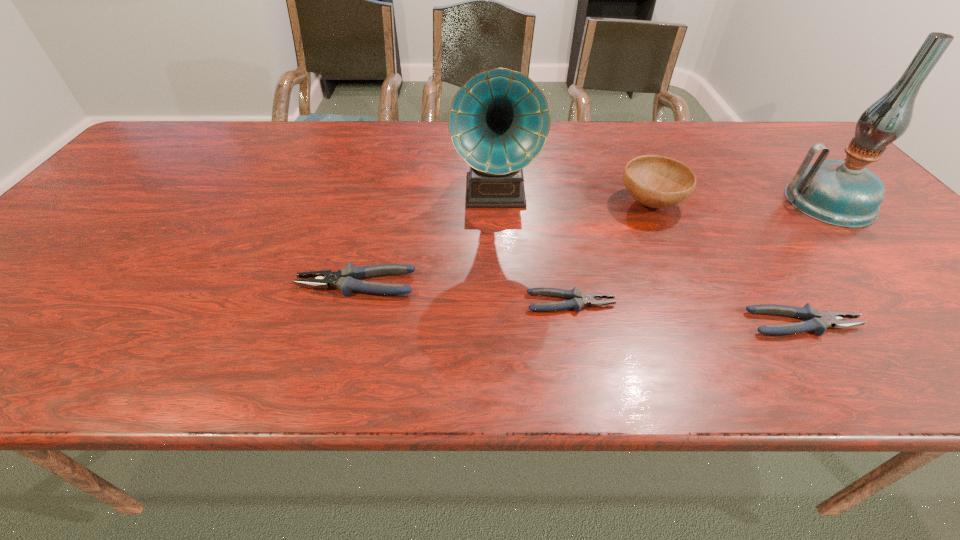
I want to click on the leftmost object, so click(x=345, y=279).

Identify the location of the shortest pliers. (578, 299).

Where is `the shortest object`? Image resolution: width=960 pixels, height=540 pixels. the shortest object is located at coordinates (578, 299).

The image size is (960, 540). What are the coordinates of `the second tallest pliers` in the screenshot? It's located at (814, 320).

Where is `the rightmost pliers`? The image size is (960, 540). the rightmost pliers is located at coordinates (814, 320).

Locate an element on the screen. The image size is (960, 540). oil lamp is located at coordinates (842, 193).

Locate an element on the screen. The height and width of the screenshot is (540, 960). the fourth shortest object is located at coordinates (655, 181).

Identify the location of the fourth object from left to right. (655, 181).

At what (x,y) coordinates should I click in order to perform the action: click on the second tallest object. Please return your answer as a coordinate pair (x, y). This screenshot has width=960, height=540. Looking at the image, I should click on (499, 121).

Find the location of `free space located at the gripping part of the leftmost pliers`. free space located at the gripping part of the leftmost pliers is located at coordinates (155, 284).